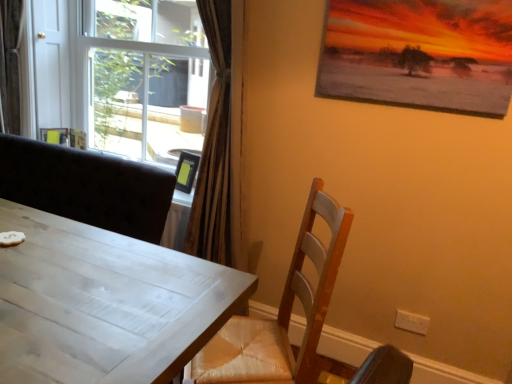
Question: From the image's perspective, is white plastic window at upper left positioned above or below white wood table at left?

Choices:
 (A) below
 (B) above

Answer: (B)

Question: From a real-world perspective, is white plastic window at upper left physically located above or below white wood table at left?

Choices:
 (A) above
 (B) below

Answer: (A)

Question: Estimate the real-world distances between objects in this image. Which object is closer to the white wood table at left?

Choices:
 (A) wooden chair at right
 (B) white plastic window at upper left
 (C) matte wooden picture frame at upper right
 (D) velvet-like brown curtain at left

Answer: (A)

Question: Based on their relative distances, which object is nearer to the white plastic window at upper left?

Choices:
 (A) velvet-like brown curtain at left
 (B) wooden chair at right
 (C) matte wooden picture frame at upper right
 (D) white wood table at left

Answer: (A)